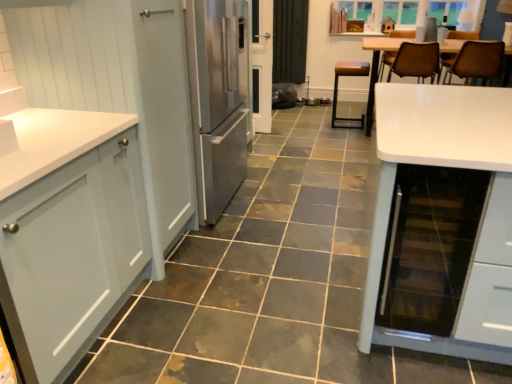
Question: Does brown leather chair at upper right, placed as the third chair when sorted from left to right, have a smaller size compared to matte white cabinet at left, the 1th cabinetry viewed from the back?

Choices:
 (A) no
 (B) yes

Answer: (B)

Question: From a real-world perspective, is brown leather chair at upper right, which is counted as the first chair, starting from the right, beneath matte white cabinet at left, the 1th cabinetry viewed from the back?

Choices:
 (A) no
 (B) yes

Answer: (A)

Question: Is brown leather chair at upper right, placed as the third chair when sorted from left to right, closer to camera compared to matte white cabinet at left, the 1th cabinetry viewed from the back?

Choices:
 (A) yes
 (B) no

Answer: (B)

Question: Is brown leather chair at upper right, placed as the third chair when sorted from left to right, bigger than matte white cabinet at left, the 1th cabinetry viewed from the back?

Choices:
 (A) no
 (B) yes

Answer: (A)

Question: Does brown leather chair at upper right, placed as the third chair when sorted from left to right, have a greater width compared to matte white cabinet at left, the second cabinetry when ordered from front to back?

Choices:
 (A) yes
 (B) no

Answer: (B)

Question: Is point (426, 140) positioned closer to the camera than point (434, 66)?

Choices:
 (A) closer
 (B) farther

Answer: (A)

Question: In terms of width, does white glossy table at right look wider or thinner when compared to brown leather chair at upper right, positioned as the second chair in right-to-left order?

Choices:
 (A) thin
 (B) wide

Answer: (B)

Question: Is white glossy table at right bigger or smaller than brown leather chair at upper right, the 2th chair viewed from the left?

Choices:
 (A) small
 (B) big

Answer: (B)

Question: Considering their positions, is white glossy table at right located in front of or behind brown leather chair at upper right, positioned as the second chair in right-to-left order?

Choices:
 (A) front
 (B) behind

Answer: (A)

Question: From a real-world perspective, is white glossy screen door at center above or below white glossy table at right?

Choices:
 (A) above
 (B) below

Answer: (A)

Question: Is white glossy screen door at center wider or thinner than white glossy table at right?

Choices:
 (A) wide
 (B) thin

Answer: (B)

Question: Is white glossy screen door at center inside the boundaries of white glossy table at right, or outside?

Choices:
 (A) inside
 (B) outside

Answer: (B)

Question: In the image, is white glossy screen door at center positioned in front of or behind white glossy table at right?

Choices:
 (A) behind
 (B) front

Answer: (A)

Question: Is brown leather stool at center, which appears as the 1th chair when viewed from the left, taller or shorter than matte gray cabinet at left, which ranks as the 2th cabinetry in back-to-front order?

Choices:
 (A) tall
 (B) short

Answer: (B)

Question: Is brown leather stool at center, acting as the third chair starting from the right, to the left or to the right of matte gray cabinet at left, which ranks as the 2th cabinetry in back-to-front order, in the image?

Choices:
 (A) left
 (B) right

Answer: (B)